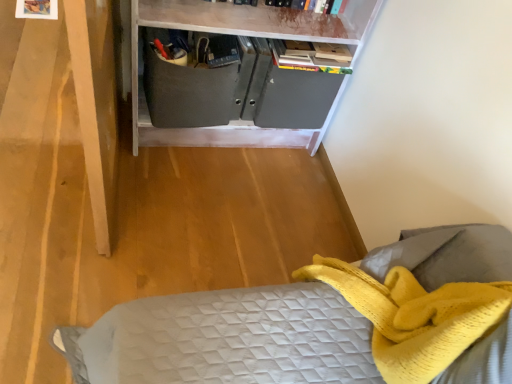
Locate an element on the screen. vacant point above matte gray cabinet at center (from a real-world perspective) is located at coordinates (204, 51).